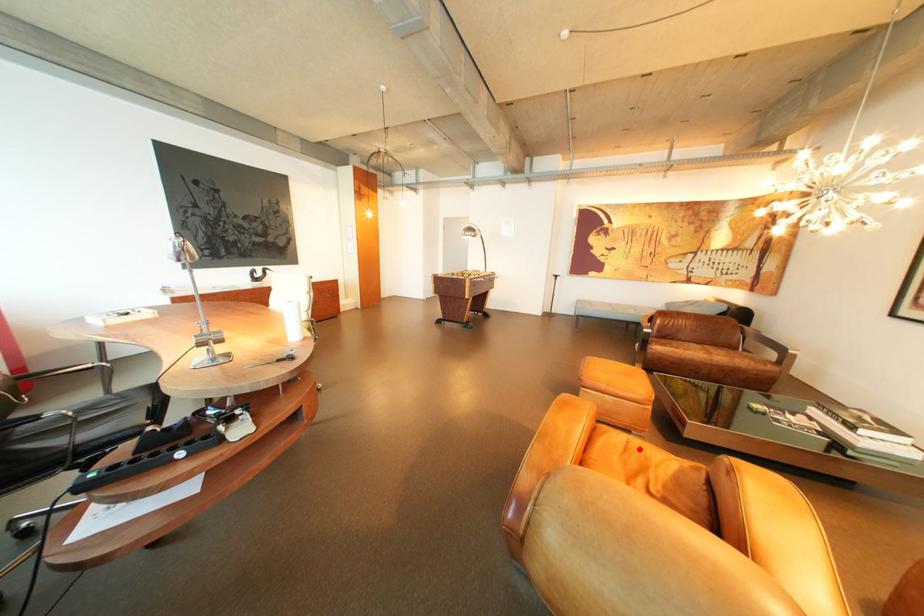
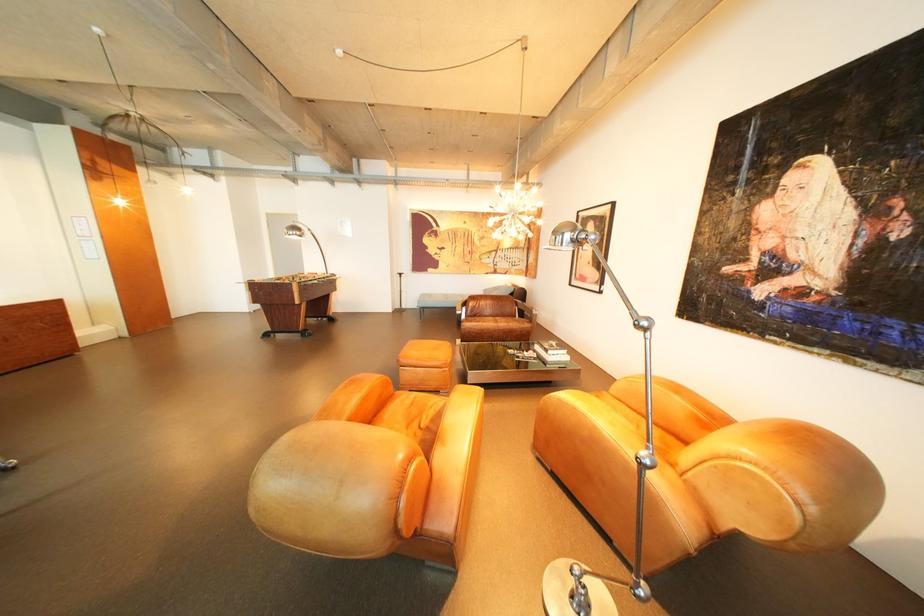
Question: I am providing you with two images of the same scene from different viewpoints. A red point is marked on the first image. At the location where the point appears in image 1, is it still visible in image 2?

Choices:
 (A) Yes
 (B) No

Answer: (A)